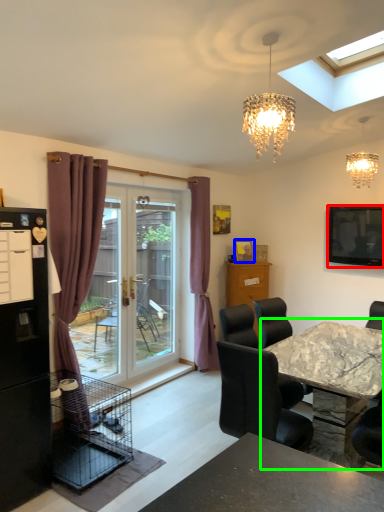
Question: Which object is the closest to the television (highlighted by a red box)? Choose among these: picture frame (highlighted by a blue box) or kitchen & dining room table (highlighted by a green box).

Choices:
 (A) picture frame
 (B) kitchen & dining room table

Answer: (B)